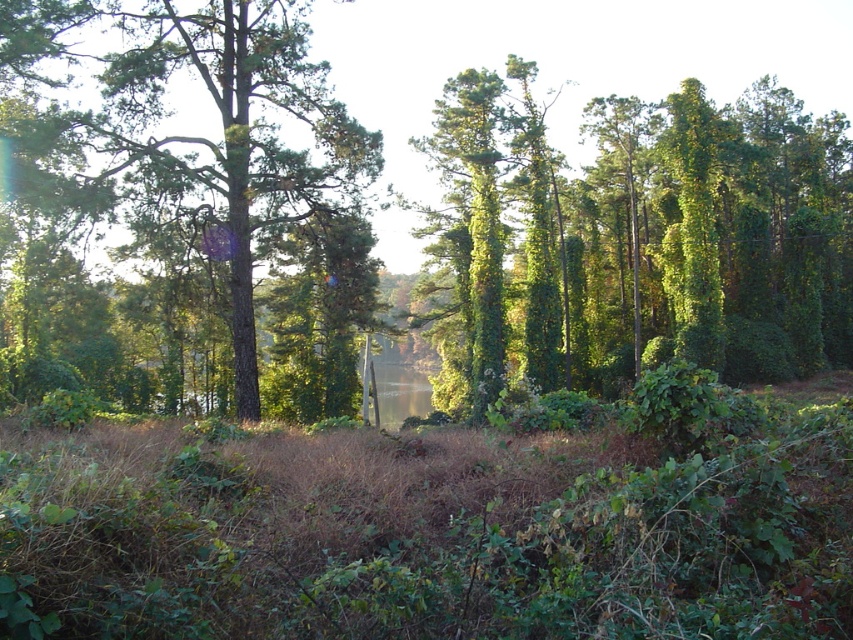
Looking at this image, you are a hiker who wants to take a photo of the green leafy tree at upper center and the green matte tree at center. Which tree should you stand closer to in order to capture both in a single frame without zooming?

You should stand closer to the green leafy tree at upper center because it is shorter than the green matte tree at center, allowing both to fit within the frame when positioned appropriately.

You are a hiker trying to navigate through the forest. You see the green leafy tree at upper center and the green matte tree at center. Which tree would you choose to walk towards if you want to find a taller tree to rest under?

The green matte tree at center is taller than the green leafy tree at upper center, so you should walk towards the green matte tree at center to find a taller tree to rest under.